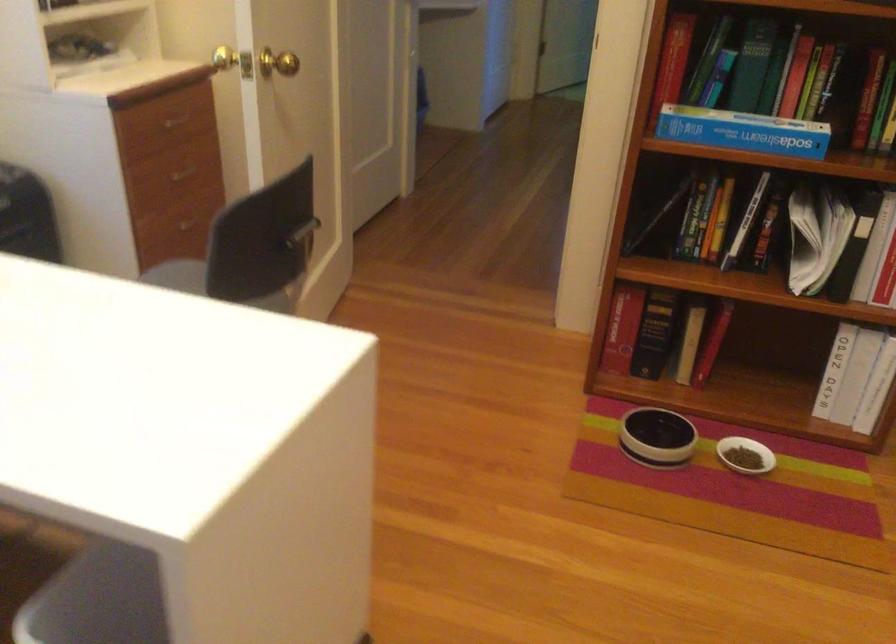
Locate an element on the screen. Image resolution: width=896 pixels, height=644 pixels. red book is located at coordinates (622, 328).